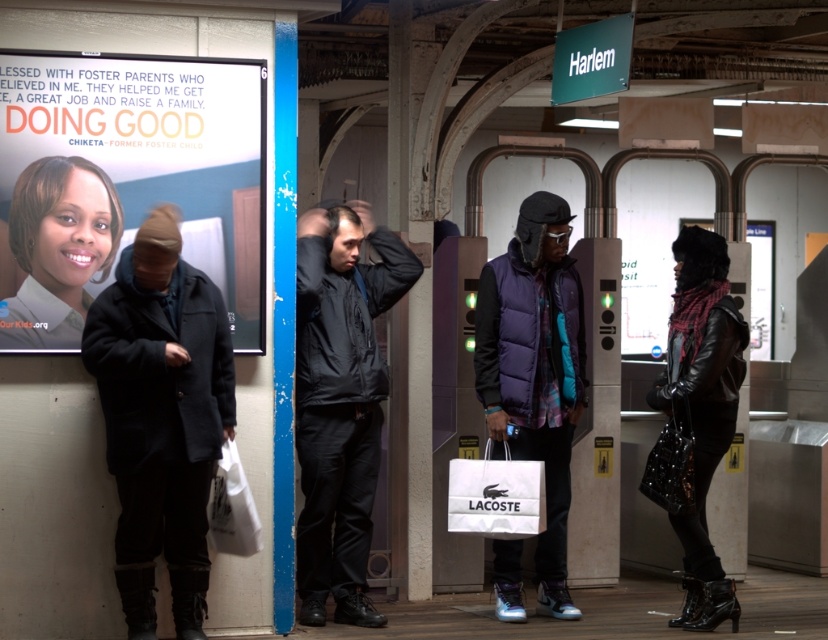
You are a photographer standing at the Harlem subway station platform. You notice a black wool coat at left and a purple down jacket at center. Which clothing item is closer to the photographer?

The black wool coat at left is closer to the photographer because it is positioned under the purple down jacket at center, indicating it is in front.

What is the spatial relationship between the black wool coat at left and the leather jacket at right in the subway station scene?

The black wool coat at left is to the left of the leather jacket at right.